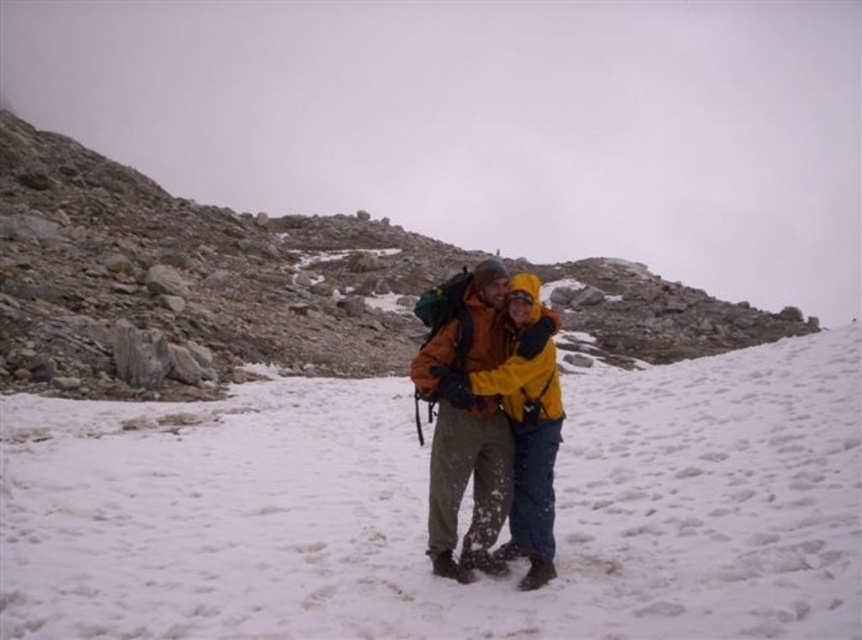
Question: Which point is farther from the camera taking this photo?

Choices:
 (A) click(x=153, y=291)
 (B) click(x=361, y=632)
 (C) click(x=503, y=428)

Answer: (A)

Question: Is rough stone mountain at center positioned behind orange softshell jacket at center?

Choices:
 (A) yes
 (B) no

Answer: (A)

Question: Among these points, which one is nearest to the camera?

Choices:
 (A) (742, 339)
 (B) (523, 332)

Answer: (B)

Question: Estimate the real-world distances between objects in this image. Which object is farther from the orange softshell jacket at center?

Choices:
 (A) white powdery snow at center
 (B) rough stone mountain at center

Answer: (B)

Question: Is rough stone mountain at center further to camera compared to orange softshell jacket at center?

Choices:
 (A) no
 (B) yes

Answer: (B)

Question: Can you confirm if rough stone mountain at center is wider than orange softshell jacket at center?

Choices:
 (A) no
 (B) yes

Answer: (B)